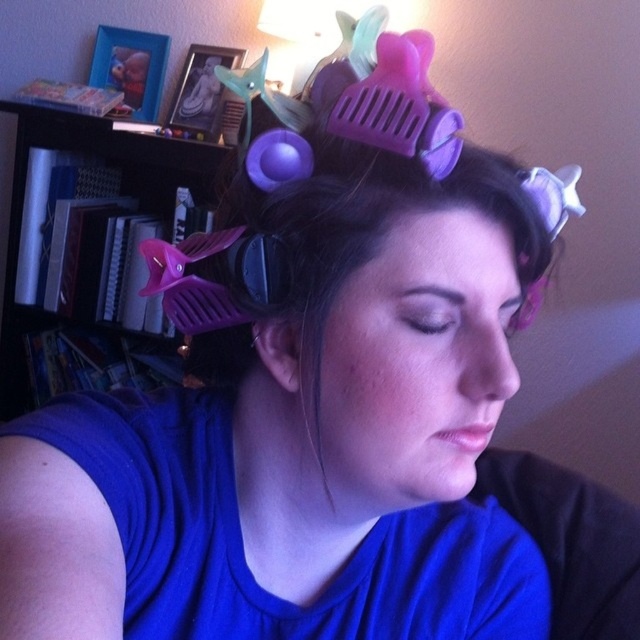
Question: Which point is closer to the camera taking this photo?

Choices:
 (A) (362, 224)
 (B) (54, 253)

Answer: (A)

Question: Is purple plastic hair rollers at center thinner than purple plastic comb at upper center?

Choices:
 (A) yes
 (B) no

Answer: (B)

Question: Estimate the real-world distances between objects in this image. Which object is farther from the purple plastic comb at upper center?

Choices:
 (A) matte plastic bookshelf at left
 (B) purple plastic hair rollers at center

Answer: (A)

Question: Which object appears closest to the camera in this image?

Choices:
 (A) purple plastic comb at upper center
 (B) purple plastic hair rollers at center
 (C) matte plastic bookshelf at left

Answer: (B)

Question: Does matte plastic bookshelf at left have a smaller size compared to purple plastic comb at upper center?

Choices:
 (A) yes
 (B) no

Answer: (B)

Question: Is purple plastic hair rollers at center wider than purple plastic comb at upper center?

Choices:
 (A) yes
 (B) no

Answer: (A)